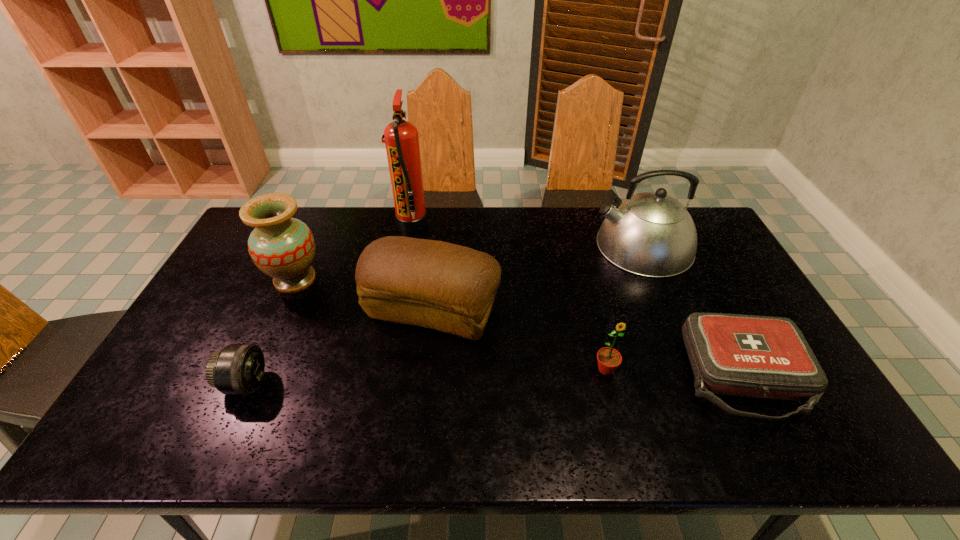
Locate an element on the screen. This screenshot has width=960, height=540. object that is at the left edge is located at coordinates (282, 247).

I want to click on kettle that is at the right edge, so click(x=652, y=234).

At what (x,y) coordinates should I click in order to perform the action: click on the first-aid kit present at the right edge. Please return your answer as a coordinate pair (x, y). This screenshot has width=960, height=540. Looking at the image, I should click on (751, 356).

The height and width of the screenshot is (540, 960). Find the location of `object that is at the far right corner`. object that is at the far right corner is located at coordinates (652, 234).

At what (x,y) coordinates should I click in order to perform the action: click on object that is at the near right corner. Please return your answer as a coordinate pair (x, y). This screenshot has height=540, width=960. Looking at the image, I should click on (751, 356).

Image resolution: width=960 pixels, height=540 pixels. In the image, there is a desktop. Find the location of `vacant space at the far edge`. vacant space at the far edge is located at coordinates (546, 225).

In the image, there is a desktop. Identify the location of vacant space at the near edge. The image size is (960, 540). (764, 436).

The height and width of the screenshot is (540, 960). In the image, there is a desktop. What are the coordinates of `free space at the left edge` in the screenshot? It's located at (204, 332).

Locate an element on the screen. vacant space at the near left corner of the desktop is located at coordinates pyautogui.click(x=138, y=427).

Find the location of a particular element. This screenshot has height=540, width=960. free space between the sunflower and the bread is located at coordinates (519, 340).